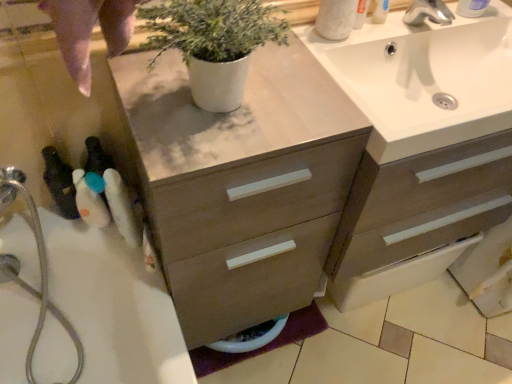
Locate an element on the screen. This screenshot has width=512, height=384. free spot in front of white glossy pot at center is located at coordinates (211, 154).